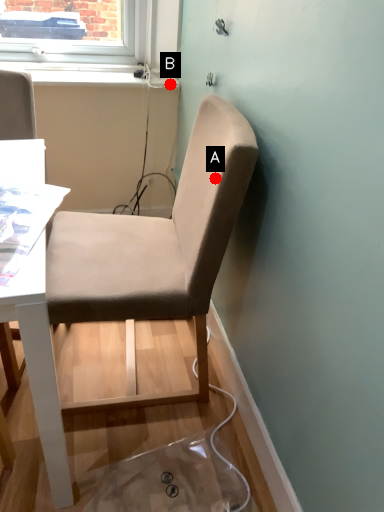
Question: Two points are circled on the image, labeled by A and B beside each circle. Which point is closer to the camera?

Choices:
 (A) A is closer
 (B) B is closer

Answer: (A)